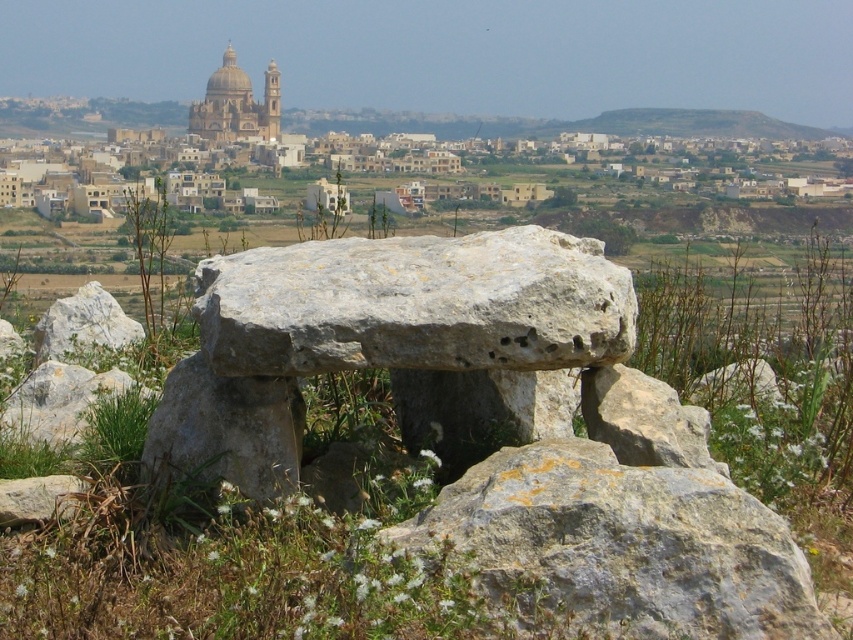
Who is positioned more to the left, gray rough rock at lower left or golden stone dome at upper center?

golden stone dome at upper center

Describe the element at coordinates (84, 324) in the screenshot. This screenshot has height=640, width=853. I see `gray rough rock at lower left` at that location.

Locate an element on the screen. gray rough rock at lower left is located at coordinates (84, 324).

Does gray rough rock at center have a lesser height compared to golden stone dome at upper center?

Yes.

Which is more to the left, gray rough rock at center or golden stone dome at upper center?

From the viewer's perspective, golden stone dome at upper center appears more on the left side.

The image size is (853, 640). Find the location of `gray rough rock at center`. gray rough rock at center is located at coordinates (619, 547).

Measure the distance between gray rough stone at center and golden stone dome at upper center.

They are 411.77 meters apart.

Which is more to the right, gray rough stone at center or golden stone dome at upper center?

gray rough stone at center

Is point (291, 458) positioned in front of point (247, 77)?

That is True.

I want to click on gray rough stone at center, so [x=225, y=432].